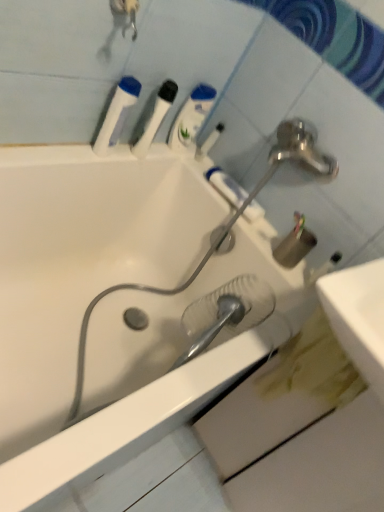
What do you see at coordinates (226, 186) in the screenshot? I see `white matte toothpaste at upper center` at bounding box center [226, 186].

Describe the element at coordinates (209, 141) in the screenshot. I see `white plastic toothbrush at upper center` at that location.

You are a GUI agent. You are given a task and a screenshot of the screen. Output one action in this format:
    pyautogui.click(x=<x>, y=<y>)
    Task: Click on the white glossy bathtub at center
    The height and width of the screenshot is (512, 384).
    Given the screenshot: What is the action you would take?
    pyautogui.click(x=120, y=304)

Is white glossy bathtub at center at the back of white plastic bottle at upper center, acting as the third mouthwash starting from the left?

white plastic bottle at upper center, acting as the third mouthwash starting from the left, does not have its back to white glossy bathtub at center.

From the image's perspective, is white plastic bottle at upper center, acting as the third mouthwash starting from the left, positioned above or below white glossy bathtub at center?

From the image's perspective, white plastic bottle at upper center, acting as the third mouthwash starting from the left, appears above white glossy bathtub at center.

Is white plastic bottle at upper center, which is counted as the first mouthwash, starting from the right, not near white glossy bathtub at center?

No, white plastic bottle at upper center, which is counted as the first mouthwash, starting from the right, is in close proximity to white glossy bathtub at center.

At what (x,y) coordinates should I click in order to perform the action: click on toothbrush behind the white glossy bathtub at center. Please return your answer as a coordinate pair (x, y). Looking at the image, I should click on (209, 141).

Is point (167, 180) in front of point (210, 144)?

Yes, it is.

Is white glossy bathtub at center positioned behind white plastic toothbrush at upper center?

No, it is in front of white plastic toothbrush at upper center.

Does point (216, 140) lie in front of point (172, 101)?

No, (216, 140) is behind (172, 101).

Is white plastic toothbrush at upper center oriented away from white plastic toothbrush at upper center, placed as the second mouthwash when sorted from right to left?

No, white plastic toothbrush at upper center is not facing the opposite direction of white plastic toothbrush at upper center, placed as the second mouthwash when sorted from right to left.

Based on the photo, from the image's perspective, which is above, white plastic toothbrush at upper center or white plastic toothbrush at upper center, positioned as the second mouthwash in left-to-right order?

white plastic toothbrush at upper center is shown above in the image.

At what (x,y) coordinates should I click in order to perform the action: click on toothbrush that appears above the white plastic toothbrush at upper center, placed as the second mouthwash when sorted from right to left (from the image's perspective). Please return your answer as a coordinate pair (x, y). The width and height of the screenshot is (384, 512). Looking at the image, I should click on (209, 141).

Can you confirm if white plastic bottle at upper left, which is counted as the third mouthwash, starting from the right, is shorter than white plastic toothbrush at upper center?

No.

Is white plastic bottle at upper left, which is counted as the first mouthwash, starting from the left, inside or outside of white plastic toothbrush at upper center?

white plastic bottle at upper left, which is counted as the first mouthwash, starting from the left, exists outside the volume of white plastic toothbrush at upper center.

From a real-world perspective, is white plastic bottle at upper left, which is counted as the third mouthwash, starting from the right, positioned under white plastic toothbrush at upper center based on gravity?

No, from a real-world perspective, white plastic bottle at upper left, which is counted as the third mouthwash, starting from the right, is not under white plastic toothbrush at upper center.

Is white plastic toothbrush at upper center touching white matte toothpaste at upper center?

No, white plastic toothbrush at upper center is not making contact with white matte toothpaste at upper center.

From the image's perspective, is white plastic toothbrush at upper center positioned above or below white matte toothpaste at upper center?

white plastic toothbrush at upper center is situated higher than white matte toothpaste at upper center in the image.

Does white plastic toothbrush at upper center have a lesser height compared to white matte toothpaste at upper center?

Incorrect, the height of white plastic toothbrush at upper center does not fall short of that of white matte toothpaste at upper center.

From a real-world perspective, which is physically below, white plastic toothbrush at upper center or white matte toothpaste at upper center?

In real-world perspective, white matte toothpaste at upper center is lower.

Is point (269, 300) closer to viewer compared to point (187, 111)?

Yes, it is in front of point (187, 111).

Between translucent plastic shower head at center and white plastic bottle at upper center, acting as the third mouthwash starting from the left, which one has larger width?

translucent plastic shower head at center is wider.

In the scene shown: Which object is closer to the camera taking this photo, translucent plastic shower head at center or white plastic bottle at upper center, acting as the third mouthwash starting from the left?

translucent plastic shower head at center is more forward.

Between translucent plastic shower head at center and white plastic bottle at upper center, acting as the third mouthwash starting from the left, which one appears on the right side from the viewer's perspective?

translucent plastic shower head at center.

Considering their positions, is white matte toothpaste at upper center located in front of or behind white glossy bathtub at center?

white matte toothpaste at upper center is positioned farther from the viewer than white glossy bathtub at center.

Is white matte toothpaste at upper center facing away from white glossy bathtub at center?

No, white matte toothpaste at upper center is not facing away from white glossy bathtub at center.

Between point (216, 173) and point (17, 460), which one is positioned in front?

Point (17, 460)

Is white glossy bathtub at center a part of white matte toothpaste at upper center?

No.

This screenshot has height=512, width=384. I want to click on bathtub on the left of white plastic bottle at upper center, acting as the third mouthwash starting from the left, so coord(120,304).

Locate an element on the screen. toothbrush that is above the white glossy bathtub at center (from the image's perspective) is located at coordinates (209, 141).

Estimate the real-world distances between objects in this image. Which object is closer to white plastic toothbrush at upper center, placed as the second mouthwash when sorted from right to left, white matte toothpaste at upper center or white plastic bottle at upper left, which is counted as the first mouthwash, starting from the left?

white plastic bottle at upper left, which is counted as the first mouthwash, starting from the left.

From the image, which object appears to be nearer to white glossy bathtub at center, white plastic toothbrush at upper center or white plastic bottle at upper center, which is counted as the first mouthwash, starting from the right?

white plastic bottle at upper center, which is counted as the first mouthwash, starting from the right, lies closer to white glossy bathtub at center than the other object.

Considering their positions, is white glossy bathtub at center positioned closer to translucent plastic shower head at center than white plastic toothbrush at upper center, positioned as the second mouthwash in left-to-right order?

white glossy bathtub at center.

When comparing their distances from white plastic toothbrush at upper center, does white matte toothpaste at upper center or white glossy bathtub at center seem closer?

white matte toothpaste at upper center is closer to white plastic toothbrush at upper center.

Based on their spatial positions, is white plastic bottle at upper center, acting as the third mouthwash starting from the left, or white matte toothpaste at upper center closer to white plastic toothbrush at upper center, placed as the second mouthwash when sorted from right to left?

The object closer to white plastic toothbrush at upper center, placed as the second mouthwash when sorted from right to left, is white plastic bottle at upper center, acting as the third mouthwash starting from the left.

Looking at the image, which one is located further to white plastic toothbrush at upper center, white plastic bottle at upper center, which is counted as the first mouthwash, starting from the right, or white plastic bottle at upper left, which is counted as the first mouthwash, starting from the left?

white plastic bottle at upper left, which is counted as the first mouthwash, starting from the left, lies further to white plastic toothbrush at upper center than the other object.

Considering their positions, is translucent plastic shower head at center positioned further to white matte toothpaste at upper center than white plastic bottle at upper center, which is counted as the first mouthwash, starting from the right?

Based on the image, translucent plastic shower head at center appears to be further to white matte toothpaste at upper center.

Based on their spatial positions, is translucent plastic shower head at center or white plastic bottle at upper left, which is counted as the third mouthwash, starting from the right, further from white plastic toothbrush at upper center?

Among the two, translucent plastic shower head at center is located further to white plastic toothbrush at upper center.

Locate an element on the screen. This screenshot has width=384, height=512. toothpaste between white plastic bottle at upper left, which is counted as the third mouthwash, starting from the right, and translucent plastic shower head at center from top to bottom is located at coordinates (226, 186).

What are the coordinates of `toothpaste positioned between white plastic toothbrush at upper center, positioned as the second mouthwash in left-to-right order, and white plastic toothbrush at upper center from near to far` in the screenshot? It's located at (226, 186).

The height and width of the screenshot is (512, 384). What are the coordinates of `mouthwash between white plastic toothbrush at upper center, positioned as the second mouthwash in left-to-right order, and white glossy bathtub at center from top to bottom` in the screenshot? It's located at (117, 114).

Find the location of a particular element. shower between white glossy bathtub at center and white matte toothpaste at upper center in the front-back direction is located at coordinates (226, 312).